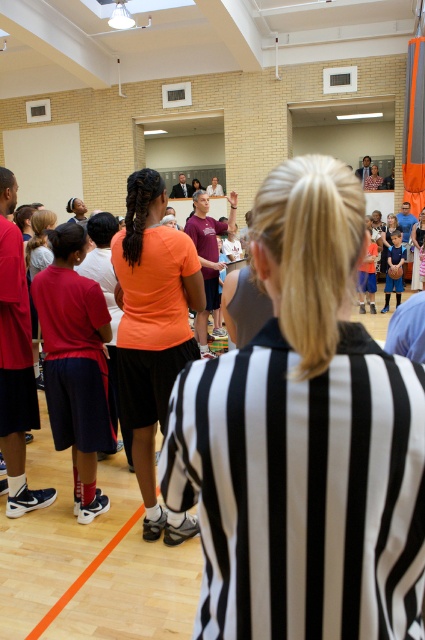
Does orange matte shirt at center have a lesser width compared to matte black referee shirt at left?

Incorrect, orange matte shirt at center's width is not less than matte black referee shirt at left's.

Consider the image. Can you confirm if orange matte shirt at center is wider than matte black referee shirt at left?

Yes, orange matte shirt at center is wider than matte black referee shirt at left.

Is point (125, 371) farther from viewer compared to point (2, 406)?

No.

What are the coordinates of `orange matte shirt at center` in the screenshot? It's located at (153, 333).

Is black and white striped shirt at center to the left of orange t-shirt at center from the viewer's perspective?

Correct, you'll find black and white striped shirt at center to the left of orange t-shirt at center.

Measure the distance between point (x=201, y=196) and camera.

Point (x=201, y=196) is 5.91 meters from camera.

The image size is (425, 640). Find the location of `black and white striped shirt at center`. black and white striped shirt at center is located at coordinates (207, 256).

Is point (260, 632) positioned before point (142, 444)?

Yes, point (260, 632) is closer to viewer.

Measure the distance between orange matte tank top at center and camera.

orange matte tank top at center is 26.40 inches from camera.

What are the coordinates of `orange matte tank top at center` in the screenshot? It's located at (303, 440).